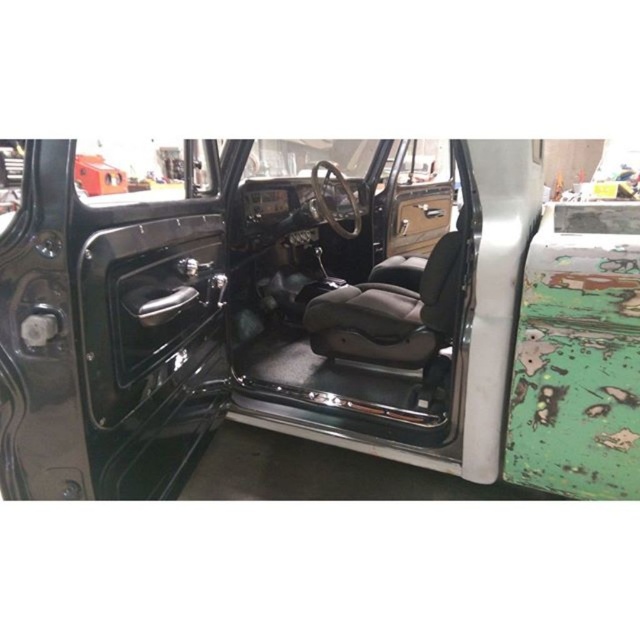
Question: Is matte black seat at center above black leather door at center?

Choices:
 (A) no
 (B) yes

Answer: (A)

Question: Is matte black seat at center smaller than black leather door at center?

Choices:
 (A) yes
 (B) no

Answer: (B)

Question: Which point is farther to the camera?

Choices:
 (A) black leather door at center
 (B) matte black seat at center

Answer: (A)

Question: Does matte black seat at center have a greater width compared to black leather door at center?

Choices:
 (A) yes
 (B) no

Answer: (A)